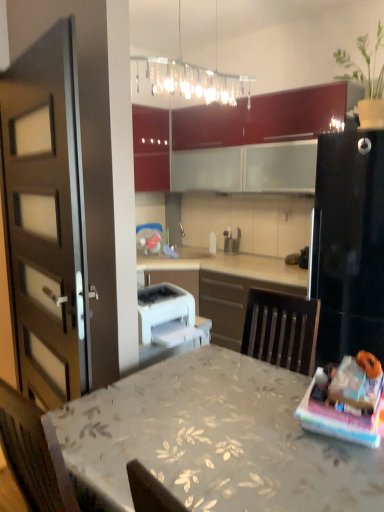
Question: From their relative heights in the image, would you say white plastic printer at center, placed as the second appliance when sorted from right to left, is taller or shorter than matte brown door at left?

Choices:
 (A) short
 (B) tall

Answer: (A)

Question: Is point (140, 304) closer or farther from the camera than point (44, 373)?

Choices:
 (A) closer
 (B) farther

Answer: (B)

Question: Which object is positioned farthest from the floral-patterned fabric table at center?

Choices:
 (A) green matte plant at upper right
 (B) matte brown door at left
 (C) clear glass light fixture at upper center
 (D) metallic silver spice shakers at center, marked as the 2th appliance in a left-to-right arrangement
 (E) matte red cabinet at upper center, positioned as the 1th cabinetry in left-to-right order

Answer: (D)

Question: Which is nearer to the glossy wood cabinets at upper center, which appears as the first cabinetry when viewed from the right?

Choices:
 (A) floral-patterned fabric table at center
 (B) green matte plant at upper right
 (C) matte brown door at left
 (D) white plastic printer at center, which ranks as the second appliance in top-to-bottom order
 (E) clear glass light fixture at upper center

Answer: (E)